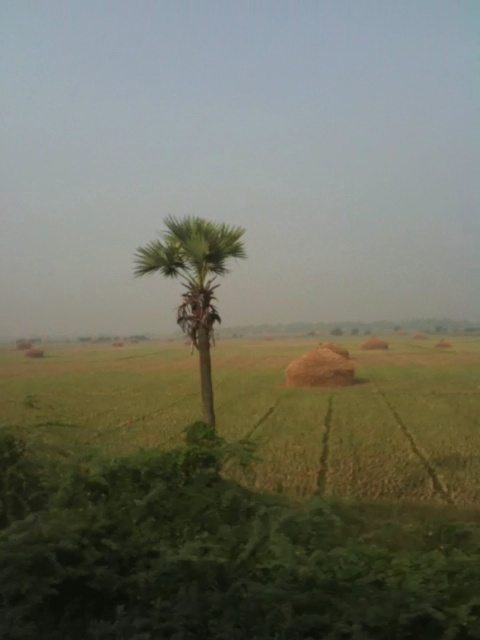
Question: Is green leafy vegetation at lower center to the left of green grassy field at center from the viewer's perspective?

Choices:
 (A) no
 (B) yes

Answer: (B)

Question: Which point is farther from the camera taking this photo?

Choices:
 (A) (302, 460)
 (B) (233, 529)
 (C) (183, 300)

Answer: (A)

Question: Does green leafy vegetation at lower center have a larger size compared to green grassy field at center?

Choices:
 (A) no
 (B) yes

Answer: (A)

Question: Can you confirm if green leafy vegetation at lower center is thinner than green grassy field at center?

Choices:
 (A) yes
 (B) no

Answer: (A)

Question: Estimate the real-world distances between objects in this image. Which object is farther from the green leafy palm at center?

Choices:
 (A) green leafy vegetation at lower center
 (B) green grassy field at center

Answer: (B)

Question: Among these objects, which one is farthest from the camera?

Choices:
 (A) green leafy vegetation at lower center
 (B) green grassy field at center

Answer: (B)